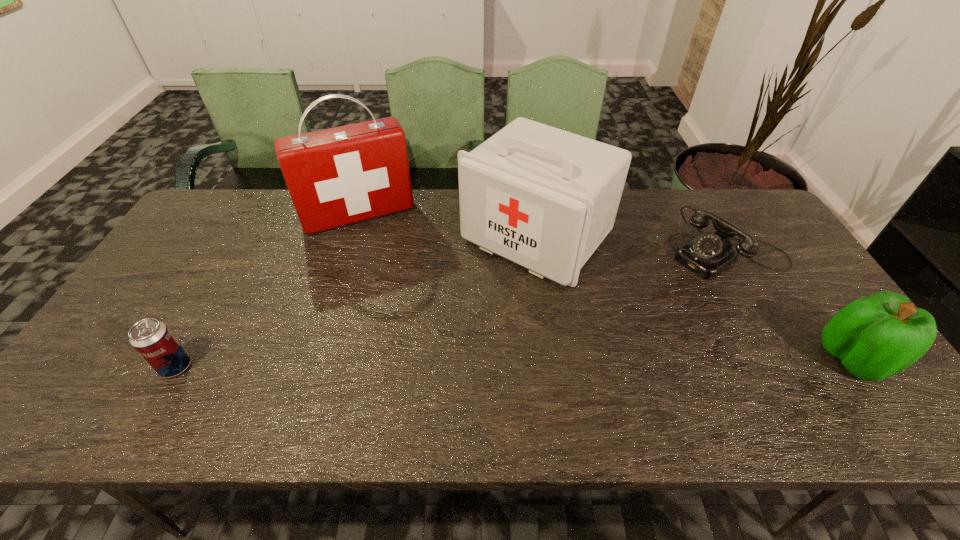
You are a GUI agent. You are given a task and a screenshot of the screen. Output one action in this format:
    pyautogui.click(x=<x>, y=<y>)
    Task: Click on the leftmost object
    
    Given the screenshot: What is the action you would take?
    pyautogui.click(x=152, y=339)

In order to click on beer can in this screenshot , I will do `click(152, 339)`.

At what (x,y) coordinates should I click in order to perform the action: click on bell pepper. Please return your answer as a coordinate pair (x, y). Looking at the image, I should click on (875, 337).

You are a GUI agent. You are given a task and a screenshot of the screen. Output one action in this format:
    pyautogui.click(x=<x>, y=<y>)
    Task: Click on the third object from right to left
    The image size is (960, 540).
    Given the screenshot: What is the action you would take?
    pyautogui.click(x=544, y=198)

This screenshot has width=960, height=540. I want to click on telephone, so click(x=708, y=254).

This screenshot has width=960, height=540. In order to click on the left first-aid kit in this screenshot , I will do `click(338, 176)`.

Find the location of a particular element. This screenshot has height=540, width=960. vacant space located 0.090m on the left of the beer can is located at coordinates (123, 367).

Identify the location of free space located 0.400m on the back of the bell pepper. (763, 228).

You are a GUI agent. You are given a task and a screenshot of the screen. Output one action in this format:
    pyautogui.click(x=<x>, y=<y>)
    Task: Click on the free space located on the front-facing side of the third object from right to left
    
    Given the screenshot: What is the action you would take?
    pyautogui.click(x=405, y=374)

Find the location of `free location located on the front-facing side of the third object from right to left`. free location located on the front-facing side of the third object from right to left is located at coordinates (411, 368).